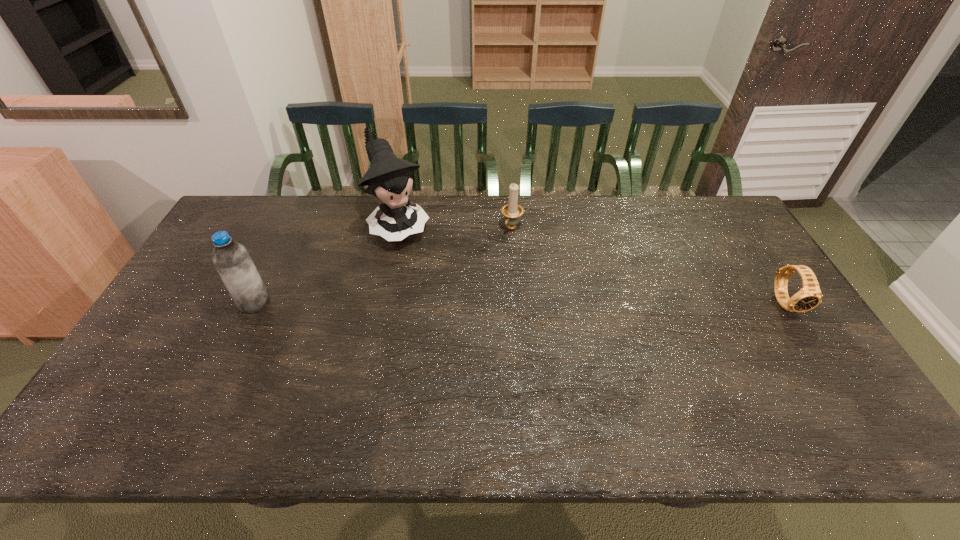
Locate an element on the screen. This screenshot has height=540, width=960. free region located 0.100m on the handle side of the second object from right to left is located at coordinates (495, 254).

I want to click on blank area located 0.310m on the handle side of the second object from right to left, so click(x=467, y=298).

The image size is (960, 540). I want to click on vacant point located 0.360m on the handle side of the second object from right to left, so click(x=458, y=309).

Where is `vacant space located 0.220m at the face of the third object from right to left`? This screenshot has width=960, height=540. vacant space located 0.220m at the face of the third object from right to left is located at coordinates (441, 292).

Locate an element on the screen. The height and width of the screenshot is (540, 960). vacant area situated at the face of the third object from right to left is located at coordinates (460, 319).

This screenshot has width=960, height=540. Find the location of `vacant space located at the face of the third object from right to left`. vacant space located at the face of the third object from right to left is located at coordinates (460, 319).

Locate an element on the screen. The height and width of the screenshot is (540, 960). candle_holder present at the far edge is located at coordinates (512, 211).

You are a GUI agent. You are given a task and a screenshot of the screen. Output one action in this format:
    pyautogui.click(x=<x>, y=<y>)
    Task: Click on the doll located at the far edge
    
    Given the screenshot: What is the action you would take?
    pyautogui.click(x=389, y=178)

At what (x,y) coordinates should I click in order to perform the action: click on object located in the right edge section of the desktop. Please return your answer as a coordinate pair (x, y). The image size is (960, 540). Looking at the image, I should click on (809, 296).

In the image, there is a desktop. Where is `free space at the far edge`? The image size is (960, 540). free space at the far edge is located at coordinates (657, 195).